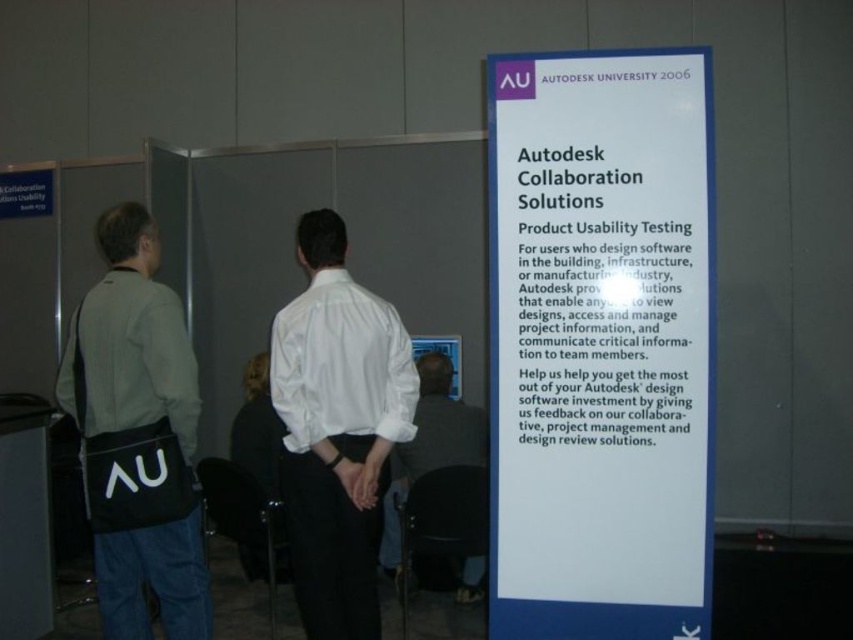
Is white paper at upper center wider than white cotton shirt at center?

Indeed, white paper at upper center has a greater width compared to white cotton shirt at center.

Consider the image. Can you confirm if white paper at upper center is positioned to the left of white cotton shirt at center?

Incorrect, white paper at upper center is not on the left side of white cotton shirt at center.

Does point (641, 317) come in front of point (351, 433)?

Yes.

Identify the location of white paper at upper center. (601, 342).

Between point (140, 388) and point (437, 454), which one is positioned in front?

Point (140, 388)

Is black fabric bag at left taller than white shirt at center?

Correct, black fabric bag at left is much taller as white shirt at center.

Measure the distance between point (184, 483) and camera.

A distance of 2.60 meters exists between point (184, 483) and camera.

You are a GUI agent. You are given a task and a screenshot of the screen. Output one action in this format:
    pyautogui.click(x=<x>, y=<y>)
    Task: Click on the black fabric bag at left
    Image resolution: width=853 pixels, height=640 pixels.
    Given the screenshot: What is the action you would take?
    pyautogui.click(x=137, y=436)

Is the position of white paper at upper center less distant than that of white shirt at center?

Yes, it is.

Is the position of white paper at upper center more distant than that of white shirt at center?

No.

What do you see at coordinates (601, 342) in the screenshot? I see `white paper at upper center` at bounding box center [601, 342].

The width and height of the screenshot is (853, 640). Find the location of `white paper at upper center`. white paper at upper center is located at coordinates (601, 342).